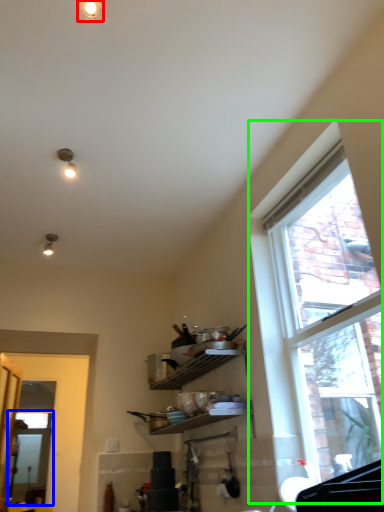
Question: Considering the real-world distances, which object is farthest from light fixture (highlighted by a red box)? screen door (highlighted by a blue box) or window (highlighted by a green box)?

Choices:
 (A) screen door
 (B) window

Answer: (A)